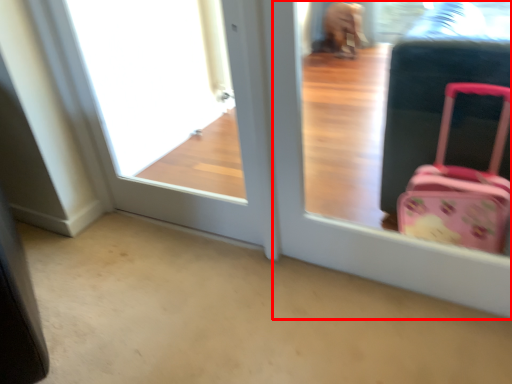
Question: Observing the image, what is the correct spatial positioning of screen door (annotated by the red box) in reference to window frame?

Choices:
 (A) left
 (B) right

Answer: (B)